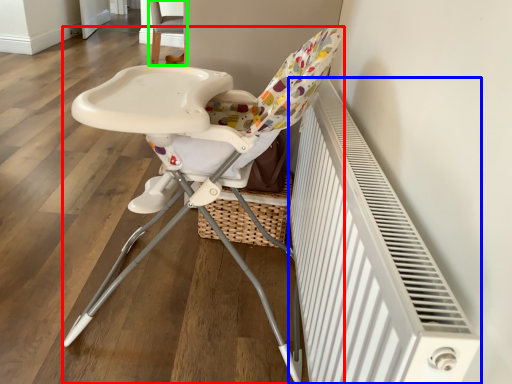
Question: Which object is the farthest from chair (highlighted by a red box)? Choose among these: radiator (highlighted by a blue box) or chair (highlighted by a green box).

Choices:
 (A) radiator
 (B) chair

Answer: (B)